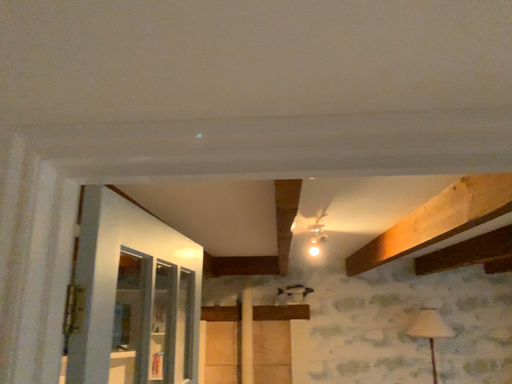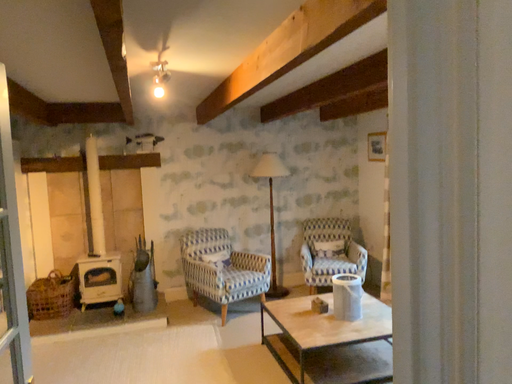
Question: How did the camera likely rotate when shooting the video?

Choices:
 (A) rotated right
 (B) rotated left

Answer: (A)